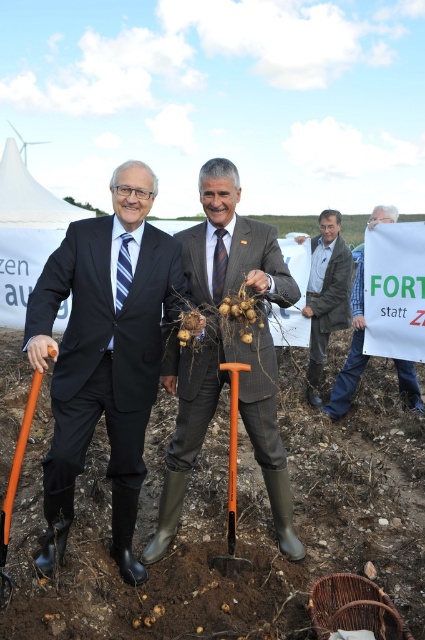
Question: Does brown soil at center have a greater width compared to leather jacket at center?

Choices:
 (A) yes
 (B) no

Answer: (A)

Question: Can you confirm if denim jacket at center is positioned below orange plastic shovel at center?

Choices:
 (A) no
 (B) yes

Answer: (A)

Question: Can you confirm if brown soil at center is smaller than black suit at center?

Choices:
 (A) no
 (B) yes

Answer: (A)

Question: Which object is farther from the camera taking this photo?

Choices:
 (A) leather jacket at center
 (B) matte gray suit at center
 (C) orange plastic shovel at center
 (D) black suit at center

Answer: (A)

Question: Based on their relative distances, which object is farther from the leather jacket at center?

Choices:
 (A) orange plastic shovel at lower left
 (B) matte gray suit at center

Answer: (A)

Question: Estimate the real-world distances between objects in this image. Which object is closer to the orange plastic shovel at lower left?

Choices:
 (A) orange plastic shovel at center
 (B) denim jacket at center

Answer: (A)